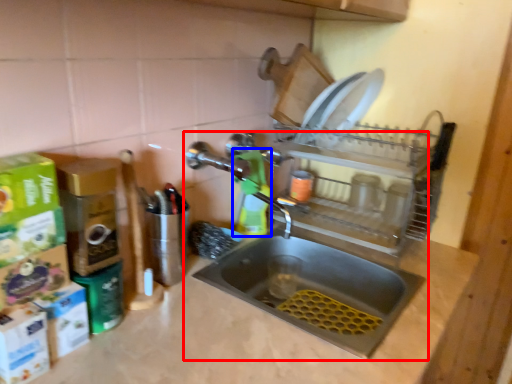
Question: Among these objects, which one is farthest to the camera, sink (highlighted by a red box) or cleaning product (highlighted by a blue box)?

Choices:
 (A) sink
 (B) cleaning product

Answer: (B)